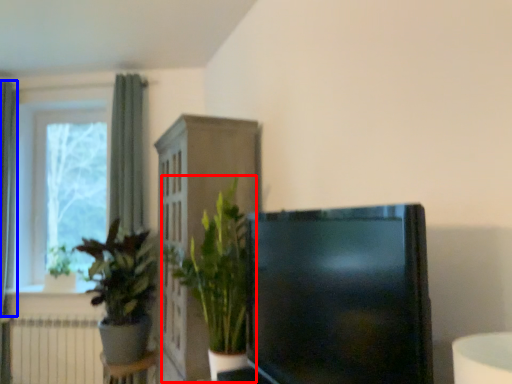
Question: Which object appears closest to the camera in this image, houseplant (highlighted by a red box) or curtain (highlighted by a blue box)?

Choices:
 (A) houseplant
 (B) curtain

Answer: (A)